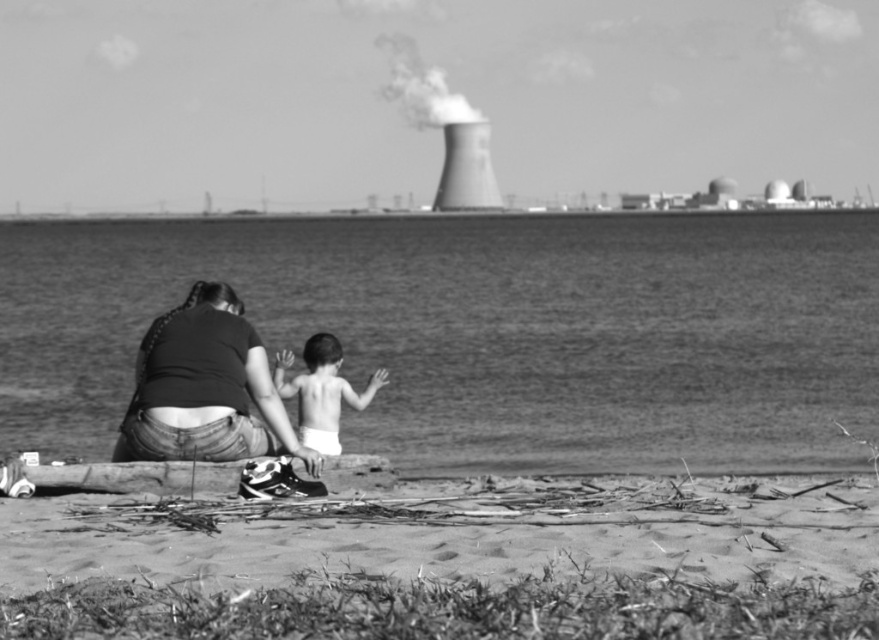
Is smooth sand at lower center closer to camera compared to denim jeans at lower left?

Yes, smooth sand at lower center is closer to the viewer.

Can you confirm if smooth sand at lower center is positioned to the right of denim jeans at lower left?

Indeed, smooth sand at lower center is positioned on the right side of denim jeans at lower left.

Between point (861, 518) and point (200, 436), which one is positioned behind?

The point (200, 436) is more distant.

This screenshot has height=640, width=879. What are the coordinates of `smooth sand at lower center` in the screenshot? It's located at (456, 531).

Consider the image. Which is above, smooth water at lower center or denim jeans at lower left?

Positioned higher is smooth water at lower center.

Which of these two, smooth water at lower center or denim jeans at lower left, stands taller?

smooth water at lower center

What do you see at coordinates (482, 332) in the screenshot? This screenshot has width=879, height=640. I see `smooth water at lower center` at bounding box center [482, 332].

Where is `smooth water at lower center`? smooth water at lower center is located at coordinates (482, 332).

Measure the distance between smooth water at lower center and smooth skin baby at center.

smooth water at lower center and smooth skin baby at center are 91.16 feet apart from each other.

Where is `smooth water at lower center`? Image resolution: width=879 pixels, height=640 pixels. smooth water at lower center is located at coordinates (482, 332).